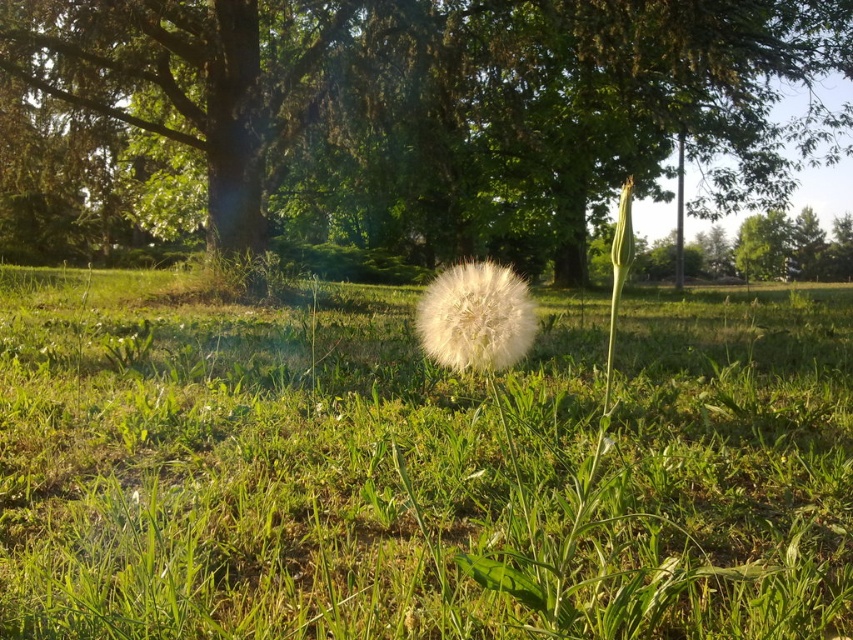
Can you confirm if brown textured tree at center is positioned below white fluffy dandelion at center?

No.

Is point (606, 144) closer to camera compared to point (451, 337)?

No, (606, 144) is behind (451, 337).

The image size is (853, 640). Identify the location of brown textured tree at center. (401, 120).

Can you confirm if green grassy at center is positioned below white fluffy dandelion at center?

Actually, green grassy at center is above white fluffy dandelion at center.

Does green grassy at center have a greater height compared to white fluffy dandelion at center?

Indeed, green grassy at center has a greater height compared to white fluffy dandelion at center.

Locate an element on the screen. Image resolution: width=853 pixels, height=640 pixels. green grassy at center is located at coordinates (419, 467).

Is green grassy at center above brown textured tree at center?

Actually, green grassy at center is below brown textured tree at center.

Who is taller, green grassy at center or brown textured tree at center?

Standing taller between the two is brown textured tree at center.

Who is more forward, (318, 486) or (316, 141)?

Point (318, 486) is more forward.

Where is `green grassy at center`? This screenshot has width=853, height=640. green grassy at center is located at coordinates (419, 467).